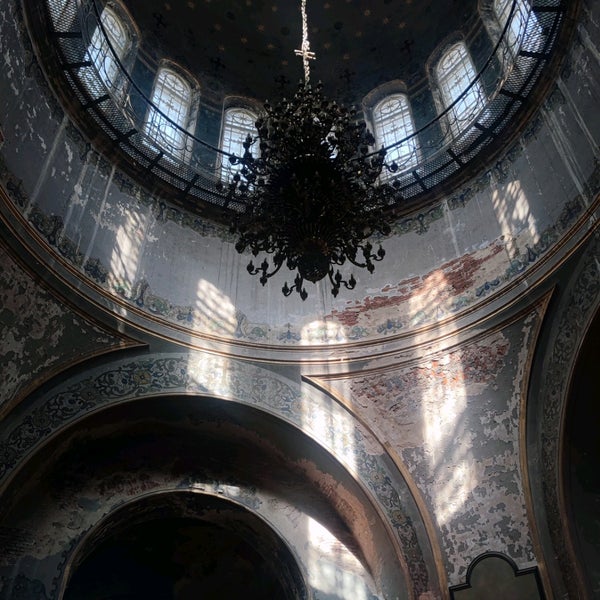
The width and height of the screenshot is (600, 600). I want to click on chandelier, so click(314, 165), click(300, 200).